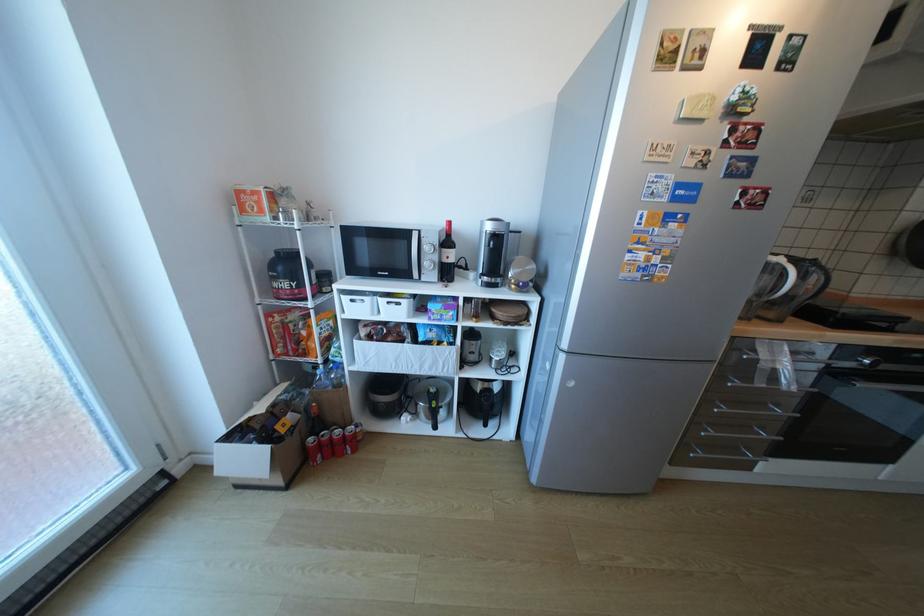
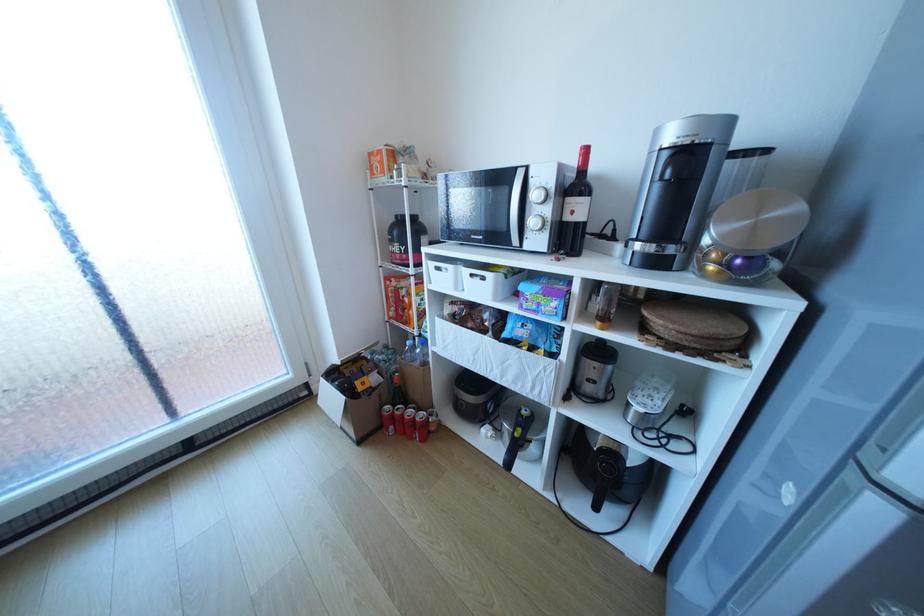
Find the pixel in the second image that matches pixel 490 422 in the first image.

(599, 499)